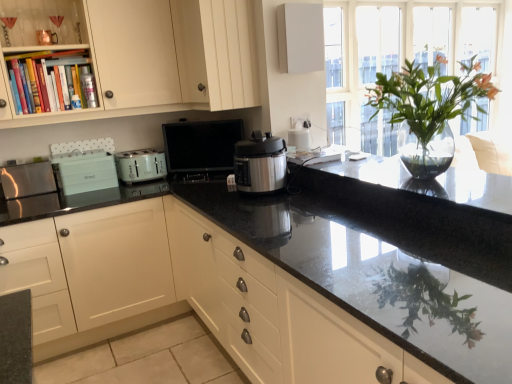
Question: Can you confirm if matte cream cabinet at upper center, arranged as the 1th cabinetry when viewed from the top, is thinner than matte black microwave at center, which is the 3th appliance from left to right?

Choices:
 (A) no
 (B) yes

Answer: (A)

Question: Is matte cream cabinet at upper center, arranged as the 1th cabinetry when viewed from the top, positioned beyond the bounds of matte black microwave at center, which is the first appliance from right to left?

Choices:
 (A) yes
 (B) no

Answer: (A)

Question: Can you confirm if matte cream cabinet at upper center, the second cabinetry from the bottom, is shorter than matte black microwave at center, which is the first appliance from right to left?

Choices:
 (A) no
 (B) yes

Answer: (A)

Question: Considering the relative positions of matte cream cabinet at upper center, arranged as the 1th cabinetry when viewed from the top, and matte black microwave at center, which is the 3th appliance from left to right, in the image provided, is matte cream cabinet at upper center, arranged as the 1th cabinetry when viewed from the top, to the left of matte black microwave at center, which is the 3th appliance from left to right, from the viewer's perspective?

Choices:
 (A) yes
 (B) no

Answer: (B)

Question: From a real-world perspective, is matte cream cabinet at upper center, the second cabinetry from the bottom, physically below matte black microwave at center, which is the 3th appliance from left to right?

Choices:
 (A) yes
 (B) no

Answer: (B)

Question: Can you confirm if matte cream cabinet at upper center, the second cabinetry from the bottom, is smaller than matte black microwave at center, which is the first appliance from right to left?

Choices:
 (A) yes
 (B) no

Answer: (B)

Question: Does matte teal toaster at left, which is counted as the 2th appliance, starting from the left, appear on the right side of black granite countertop at center, the second countertop from the top?

Choices:
 (A) yes
 (B) no

Answer: (B)

Question: Does matte teal toaster at left, which is counted as the 2th appliance, starting from the left, have a greater width compared to black granite countertop at center, which is the first countertop from bottom to top?

Choices:
 (A) no
 (B) yes

Answer: (A)

Question: From the image's perspective, does matte teal toaster at left, positioned as the 2th appliance in right-to-left order, appear higher than black granite countertop at center, which is the first countertop from bottom to top?

Choices:
 (A) no
 (B) yes

Answer: (B)

Question: Is the depth of matte teal toaster at left, positioned as the 2th appliance in right-to-left order, greater than that of black granite countertop at center, the second countertop from the top?

Choices:
 (A) no
 (B) yes

Answer: (B)

Question: Is matte teal toaster at left, which is counted as the 2th appliance, starting from the left, aimed at black granite countertop at center, which is the first countertop from bottom to top?

Choices:
 (A) no
 (B) yes

Answer: (B)

Question: Is matte teal toaster at left, which is counted as the 2th appliance, starting from the left, shorter than black granite countertop at center, the second countertop from the top?

Choices:
 (A) no
 (B) yes

Answer: (B)

Question: Is matte white cabinet at center, arranged as the second cabinetry when viewed from the top, surrounding clear glass vase at upper right?

Choices:
 (A) no
 (B) yes

Answer: (A)